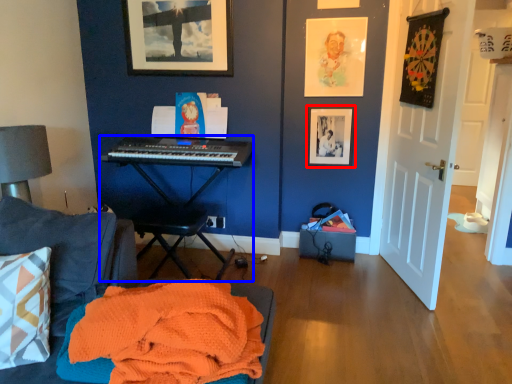
Question: Which object is further to the camera taking this photo, picture frame (highlighted by a red box) or piano (highlighted by a blue box)?

Choices:
 (A) picture frame
 (B) piano

Answer: (A)